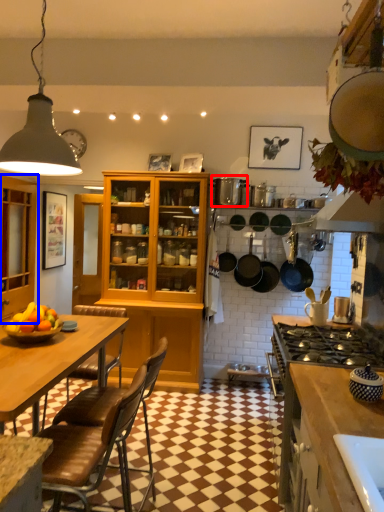
Question: Among these objects, which one is nearest to the camera, appliance (highlighted by a red box) or cabinetry (highlighted by a blue box)?

Choices:
 (A) appliance
 (B) cabinetry

Answer: (B)